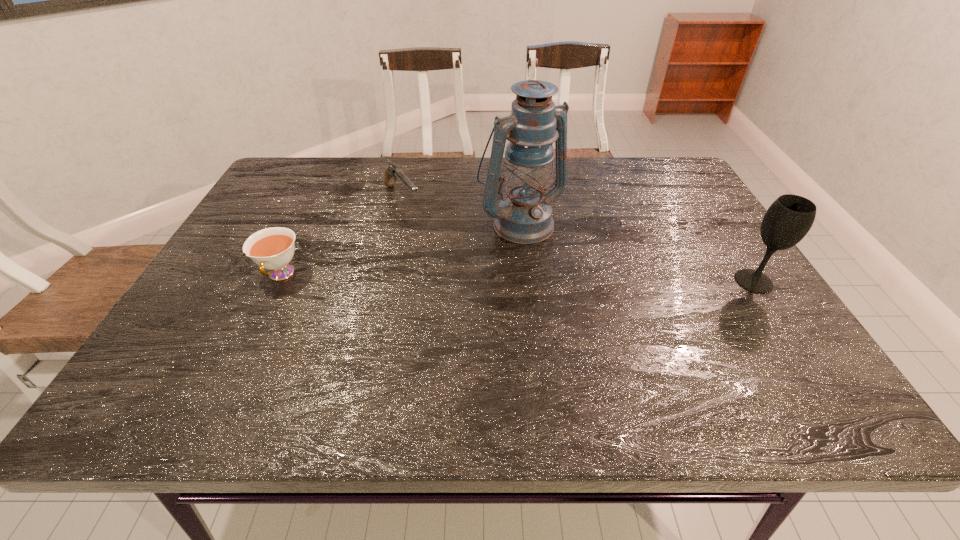
You are a GUI agent. You are given a task and a screenshot of the screen. Output one action in this format:
    pyautogui.click(x=<x>, y=<y>)
    Task: Click on the object that is the closest one to the leftmost object
    
    Given the screenshot: What is the action you would take?
    pyautogui.click(x=392, y=172)